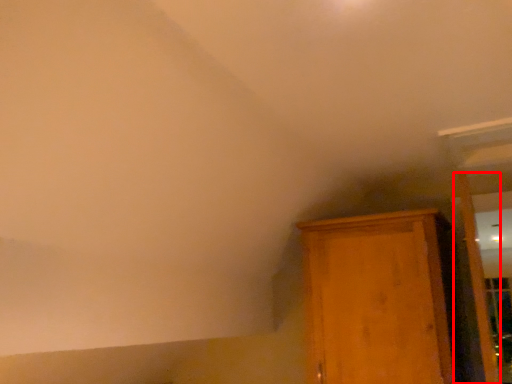
Question: From the image, what is the correct spatial relationship of door (annotated by the red box) in relation to cupboard?

Choices:
 (A) left
 (B) right

Answer: (B)